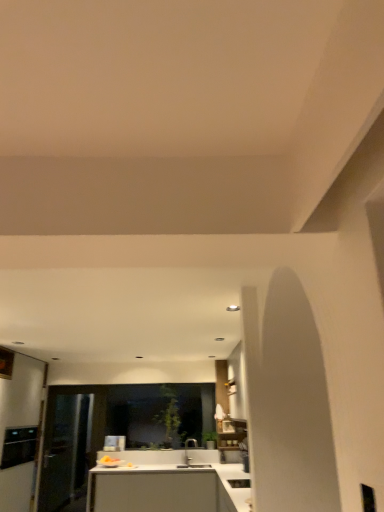
Question: Can you confirm if white glossy sink at lower center, arranged as the 1th appliance when viewed from the right, is taller than black stainless steel oven at left, placed as the second appliance when sorted from right to left?

Choices:
 (A) no
 (B) yes

Answer: (A)

Question: Is white glossy sink at lower center, arranged as the 1th appliance when viewed from the right, oriented away from black stainless steel oven at left, acting as the 1th appliance starting from the left?

Choices:
 (A) no
 (B) yes

Answer: (A)

Question: Does white glossy sink at lower center, which is the second appliance in left-to-right order, appear on the right side of black stainless steel oven at left, placed as the second appliance when sorted from right to left?

Choices:
 (A) yes
 (B) no

Answer: (A)

Question: Is white glossy sink at lower center, which is the second appliance in left-to-right order, at the left side of black stainless steel oven at left, which is the first appliance in back-to-front order?

Choices:
 (A) yes
 (B) no

Answer: (B)

Question: Does white glossy sink at lower center, which is the second appliance in left-to-right order, turn towards black stainless steel oven at left, the second appliance when ordered from front to back?

Choices:
 (A) no
 (B) yes

Answer: (A)

Question: Does white glossy sink at lower center, which is the second appliance in left-to-right order, have a lesser width compared to black stainless steel oven at left, placed as the second appliance when sorted from right to left?

Choices:
 (A) no
 (B) yes

Answer: (B)

Question: Does matte silver faucet at center appear on the left side of white glossy sink at lower center, arranged as the 1th appliance when viewed from the right?

Choices:
 (A) no
 (B) yes

Answer: (B)

Question: Could you tell me if matte silver faucet at center is facing white glossy sink at lower center, which is the 1th appliance in front-to-back order?

Choices:
 (A) yes
 (B) no

Answer: (B)

Question: Is matte silver faucet at center facing away from white glossy sink at lower center, arranged as the 1th appliance when viewed from the right?

Choices:
 (A) yes
 (B) no

Answer: (B)

Question: From a real-world perspective, is matte silver faucet at center located beneath white glossy sink at lower center, which is the 1th appliance in front-to-back order?

Choices:
 (A) no
 (B) yes

Answer: (A)

Question: Considering the relative sizes of matte silver faucet at center and white glossy sink at lower center, which appears as the second appliance when viewed from the back, in the image provided, is matte silver faucet at center smaller than white glossy sink at lower center, which appears as the second appliance when viewed from the back,?

Choices:
 (A) yes
 (B) no

Answer: (A)

Question: From the image's perspective, is matte silver faucet at center beneath white glossy sink at lower center, which appears as the second appliance when viewed from the back?

Choices:
 (A) yes
 (B) no

Answer: (A)

Question: Can you confirm if matte silver faucet at center is bigger than black stainless steel oven at left, acting as the 1th appliance starting from the left?

Choices:
 (A) yes
 (B) no

Answer: (B)